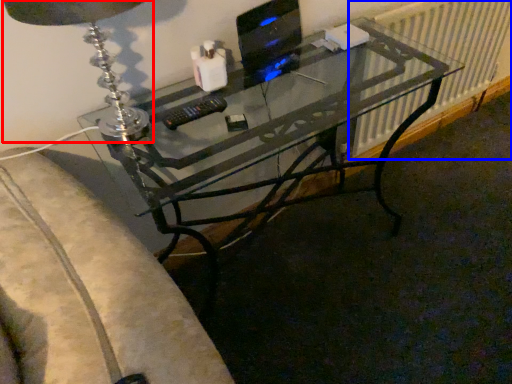
Question: Which point is closer to the camera, table lamp (highlighted by a red box) or radiator (highlighted by a blue box)?

Choices:
 (A) table lamp
 (B) radiator

Answer: (A)